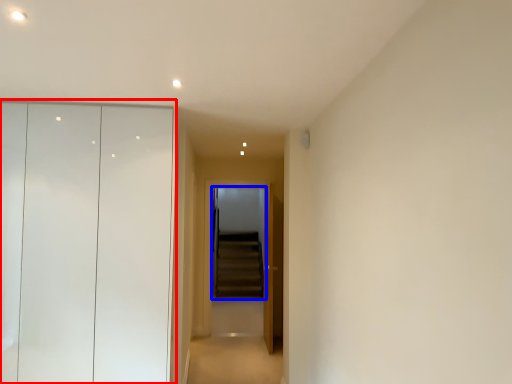
Question: Which of the following is the closest to the observer, dresser (highlighted by a red box) or screen door (highlighted by a blue box)?

Choices:
 (A) dresser
 (B) screen door

Answer: (A)